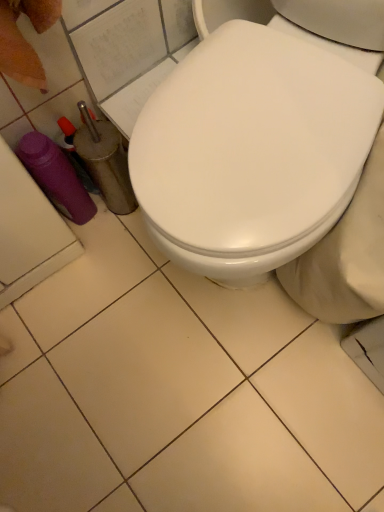
Question: Can you confirm if purple plastic bottle at lower left is taller than white glossy toilet seat at center?

Choices:
 (A) yes
 (B) no

Answer: (B)

Question: From a real-world perspective, is purple plastic bottle at lower left physically below white glossy toilet seat at center?

Choices:
 (A) no
 (B) yes

Answer: (B)

Question: Can we say purple plastic bottle at lower left lies outside white glossy toilet seat at center?

Choices:
 (A) yes
 (B) no

Answer: (A)

Question: From a real-world perspective, is purple plastic bottle at lower left on white glossy toilet seat at center?

Choices:
 (A) yes
 (B) no

Answer: (B)

Question: Can you confirm if purple plastic bottle at lower left is shorter than white glossy toilet seat at center?

Choices:
 (A) yes
 (B) no

Answer: (A)

Question: Is purple plastic bottle at lower left positioned with its back to white glossy toilet seat at center?

Choices:
 (A) yes
 (B) no

Answer: (B)

Question: From the image's perspective, would you say purple plastic bottle at lower left is positioned over white glossy toilet at center?

Choices:
 (A) yes
 (B) no

Answer: (B)

Question: Considering the relative positions of purple plastic bottle at lower left and white glossy toilet at center in the image provided, is purple plastic bottle at lower left to the left of white glossy toilet at center from the viewer's perspective?

Choices:
 (A) yes
 (B) no

Answer: (A)

Question: Is white glossy toilet at center surrounded by purple plastic bottle at lower left?

Choices:
 (A) yes
 (B) no

Answer: (B)

Question: From the image's perspective, would you say purple plastic bottle at lower left is shown under white glossy toilet at center?

Choices:
 (A) no
 (B) yes

Answer: (B)

Question: Does purple plastic bottle at lower left have a smaller size compared to white glossy toilet at center?

Choices:
 (A) yes
 (B) no

Answer: (A)

Question: Can you confirm if purple plastic bottle at lower left is shorter than white glossy toilet at center?

Choices:
 (A) no
 (B) yes

Answer: (B)

Question: Does white glossy toilet at center have a lesser height compared to purple plastic bottle at lower left?

Choices:
 (A) no
 (B) yes

Answer: (A)